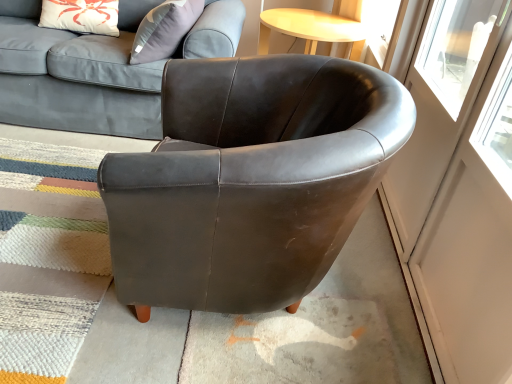
Question: From the image's perspective, would you say matte gray fabric couch at upper left is shown under matte brown leather armchair at center?

Choices:
 (A) yes
 (B) no

Answer: (B)

Question: Considering the relative sizes of matte gray fabric couch at upper left and matte brown leather armchair at center in the image provided, is matte gray fabric couch at upper left thinner than matte brown leather armchair at center?

Choices:
 (A) yes
 (B) no

Answer: (B)

Question: Does matte gray fabric couch at upper left lie behind matte brown leather armchair at center?

Choices:
 (A) no
 (B) yes

Answer: (B)

Question: Is matte gray fabric couch at upper left at the right side of matte brown leather armchair at center?

Choices:
 (A) no
 (B) yes

Answer: (A)

Question: Considering the relative sizes of matte gray fabric couch at upper left and matte brown leather armchair at center in the image provided, is matte gray fabric couch at upper left wider than matte brown leather armchair at center?

Choices:
 (A) yes
 (B) no

Answer: (A)

Question: Is matte gray fabric couch at upper left at the left side of matte brown leather armchair at center?

Choices:
 (A) no
 (B) yes

Answer: (B)

Question: Can you confirm if matte brown leather armchair at center is taller than transparent glass screen door at right?

Choices:
 (A) no
 (B) yes

Answer: (A)

Question: From the image's perspective, is matte brown leather armchair at center on top of transparent glass screen door at right?

Choices:
 (A) yes
 (B) no

Answer: (A)

Question: From a real-world perspective, is matte brown leather armchair at center physically below transparent glass screen door at right?

Choices:
 (A) no
 (B) yes

Answer: (B)

Question: From a real-world perspective, is matte brown leather armchair at center positioned over transparent glass screen door at right based on gravity?

Choices:
 (A) yes
 (B) no

Answer: (B)

Question: Considering the relative sizes of matte brown leather armchair at center and transparent glass screen door at right in the image provided, is matte brown leather armchair at center thinner than transparent glass screen door at right?

Choices:
 (A) no
 (B) yes

Answer: (A)

Question: Is matte brown leather armchair at center oriented away from transparent glass screen door at right?

Choices:
 (A) yes
 (B) no

Answer: (A)

Question: Would you say matte gray fabric couch at upper left is outside transparent glass screen door at right?

Choices:
 (A) no
 (B) yes

Answer: (B)